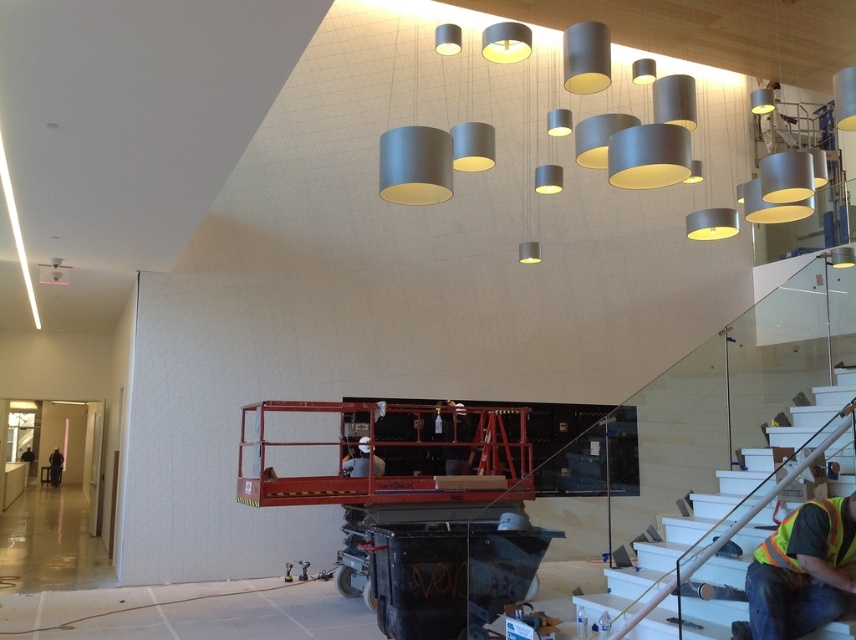
Question: Which point appears farthest from the camera in this image?

Choices:
 (A) (54, 472)
 (B) (788, 614)

Answer: (A)

Question: Which object is positioned farthest from the dark gray uniform at lower left?

Choices:
 (A) reflective safety vest at lower right
 (B) white glossy stair at lower right

Answer: (A)

Question: Which point is farther to the camera?

Choices:
 (A) dark gray uniform at lower left
 (B) white glossy stair at lower right
 (C) reflective safety vest at lower right

Answer: (A)

Question: Is reflective safety vest at lower right closer to camera compared to dark gray uniform at lower left?

Choices:
 (A) no
 (B) yes

Answer: (B)

Question: Does white glossy stair at lower right have a smaller size compared to reflective safety vest at lower right?

Choices:
 (A) no
 (B) yes

Answer: (A)

Question: Is white glossy stair at lower right behind reflective safety vest at lower right?

Choices:
 (A) no
 (B) yes

Answer: (B)